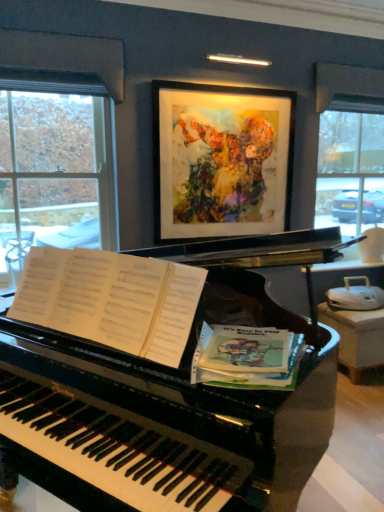
This screenshot has width=384, height=512. Identify the location of blank space above watercolor painting at upper center (from a real-world perspective). (223, 94).